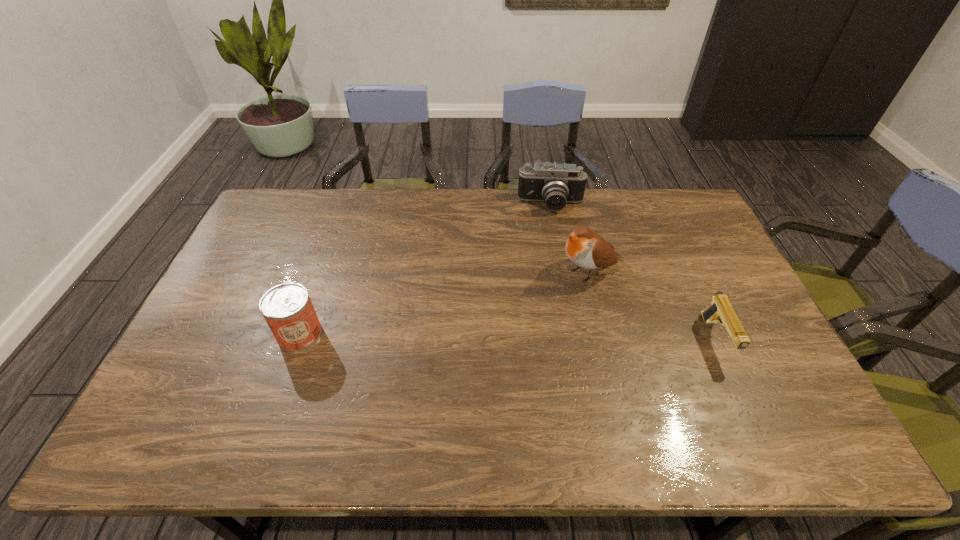
At what (x,y) coordinates should I click in order to perform the action: click on vacant region located 0.110m on the front-facing side of the camera. Please return your answer as a coordinate pair (x, y). Looking at the image, I should click on (552, 238).

Where is `blank space located 0.300m at the face of the second farthest object`? This screenshot has height=540, width=960. blank space located 0.300m at the face of the second farthest object is located at coordinates (479, 321).

Where is `free location located 0.340m at the face of the second farthest object`? Image resolution: width=960 pixels, height=540 pixels. free location located 0.340m at the face of the second farthest object is located at coordinates 467,327.

Locate an element on the screen. The height and width of the screenshot is (540, 960). vacant space located 0.360m at the face of the second farthest object is located at coordinates pyautogui.click(x=460, y=330).

The width and height of the screenshot is (960, 540). Identify the location of object present at the far edge. (556, 184).

Find the location of a particular element. The image size is (960, 540). object situated at the right edge is located at coordinates (720, 310).

What are the coordinates of `free space at the far edge of the desktop` in the screenshot? It's located at (551, 223).

Where is `vacant area at the near edge of the desktop`? vacant area at the near edge of the desktop is located at coordinates (380, 394).

I want to click on free point at the right edge, so click(x=766, y=360).

Where is `free space at the far left corner`? free space at the far left corner is located at coordinates (290, 222).